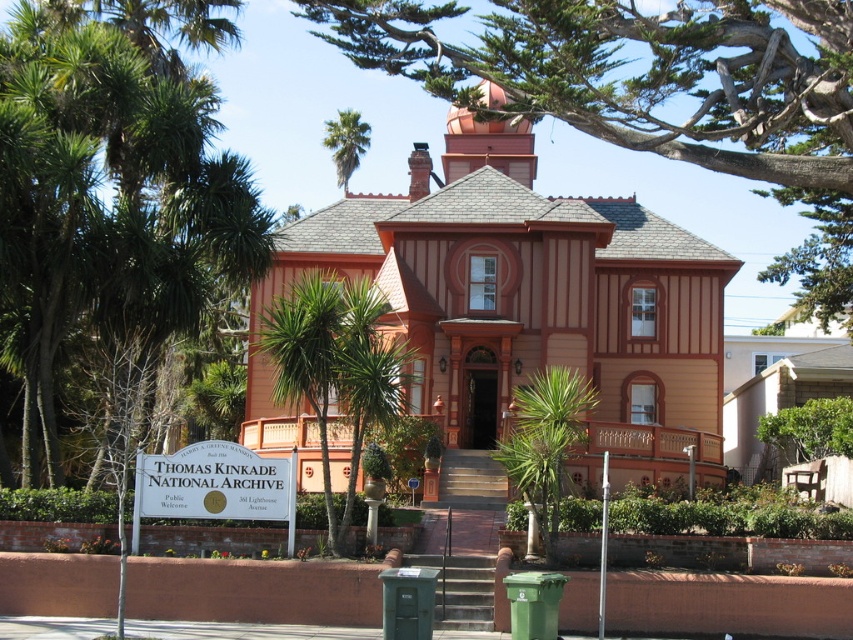
You are a gardener planning to water the green leafy palm tree at left and the green leafy palm tree at upper center. Since you can only reach up to 2 meters, can you water both trees without needing a ladder?

The green leafy palm tree at left is positioned under the green leafy palm tree at upper center. Since the lower tree is under the upper one, you can water the green leafy palm tree at left easily. However, the green leafy palm tree at upper center is higher up, so you might need a ladder to reach it unless it is within your 2 meter reach.

You are standing in front of the historic building and want to take a photo that includes both the green leafy palm tree at left and the green leafy tree at upper center. Which tree should you position closer to the left side of your camera frame?

The green leafy palm tree at left should be positioned closer to the left side of your camera frame since it is already located to the left of the green leafy tree at upper center.

You are standing in front of the historic building and want to take a photo that includes both the green leafy tree at upper center and the green leafy palm tree at upper center. Which tree should you position closer to the camera to ensure both are in focus?

You should position the green leafy tree at upper center closer to the camera since it is already closer to the viewer than the green leafy palm tree at upper center, ensuring both are within the focal range.